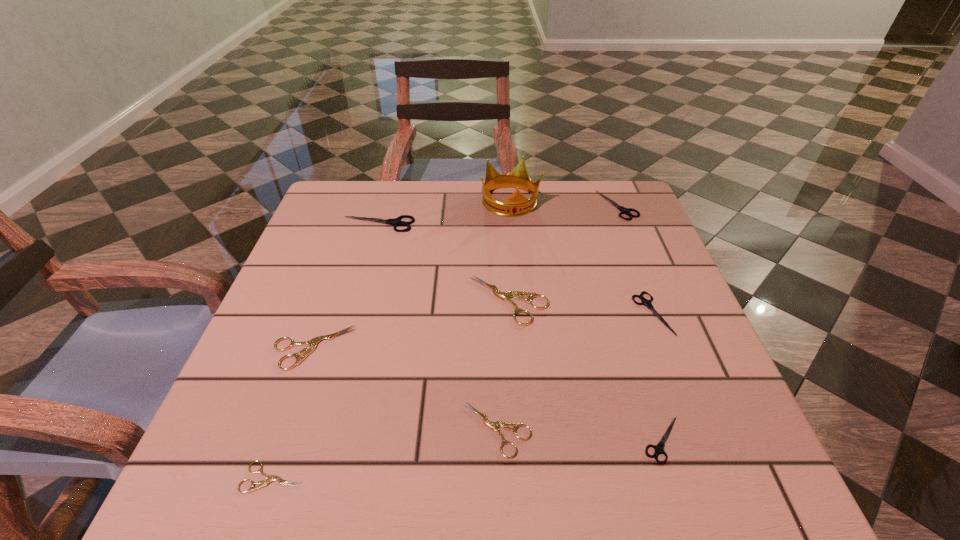
The height and width of the screenshot is (540, 960). Identify the location of the smallest beige shears. (269, 478).

This screenshot has height=540, width=960. What are the coordinates of `the shortest shears` in the screenshot? It's located at (269, 478).

Where is `free region located on the left of the crown`? free region located on the left of the crown is located at coordinates (366, 202).

I want to click on free spot located 0.190m on the front of the leftmost black shears, so click(x=360, y=286).

At what (x,y) coordinates should I click in order to perform the action: click on free location located on the left of the second biggest black shears. Please return your answer as a coordinate pair (x, y). This screenshot has width=960, height=540. Looking at the image, I should click on (560, 205).

In order to click on free space located on the back of the biggest beige shears in this screenshot , I will do `click(503, 212)`.

Identify the location of free spot located 0.060m on the back of the third farthest black shears. (637, 273).

The image size is (960, 540). I want to click on vacant space located 0.290m on the back of the third smallest beige shears, so click(x=351, y=237).

Where is `free spot located on the left of the second nearest beige shears`? This screenshot has width=960, height=540. free spot located on the left of the second nearest beige shears is located at coordinates (364, 429).

Image resolution: width=960 pixels, height=540 pixels. Identify the location of free space located 0.230m on the back of the smallest black shears. (623, 314).